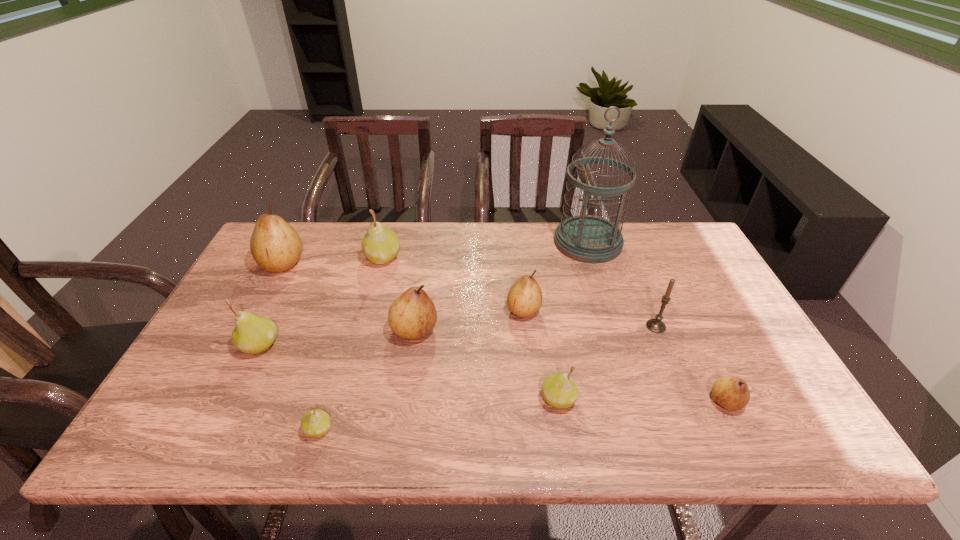
This screenshot has height=540, width=960. Identify the location of vacant space at the far edge of the desktop. (549, 222).

The width and height of the screenshot is (960, 540). Find the location of `blank space at the near edge`. blank space at the near edge is located at coordinates (374, 436).

The width and height of the screenshot is (960, 540). I want to click on vacant space at the left edge, so (x=199, y=344).

The image size is (960, 540). I want to click on vacant region at the right edge, so click(x=684, y=280).

At what (x,y) coordinates should I click in order to perform the action: click on vacant area that lies between the second brown pear from left to right and the farthest green pear. Please return your answer as a coordinate pair (x, y). The image size is (960, 540). Looking at the image, I should click on (398, 294).

Identify the location of free point between the second brown pear from right to left and the nearest object. (421, 370).

Find the location of `vacant space that's between the rightmost green pear and the farthest green pear`. vacant space that's between the rightmost green pear and the farthest green pear is located at coordinates (470, 328).

This screenshot has width=960, height=540. I want to click on vacant area that lies between the second smallest brown pear and the gray candle, so click(x=589, y=318).

In order to click on free area in between the gray candle and the tallest object in this screenshot , I will do `click(622, 285)`.

Locate an element on the screen. vacant point located between the leftmost brown pear and the second brown pear from right to left is located at coordinates (403, 287).